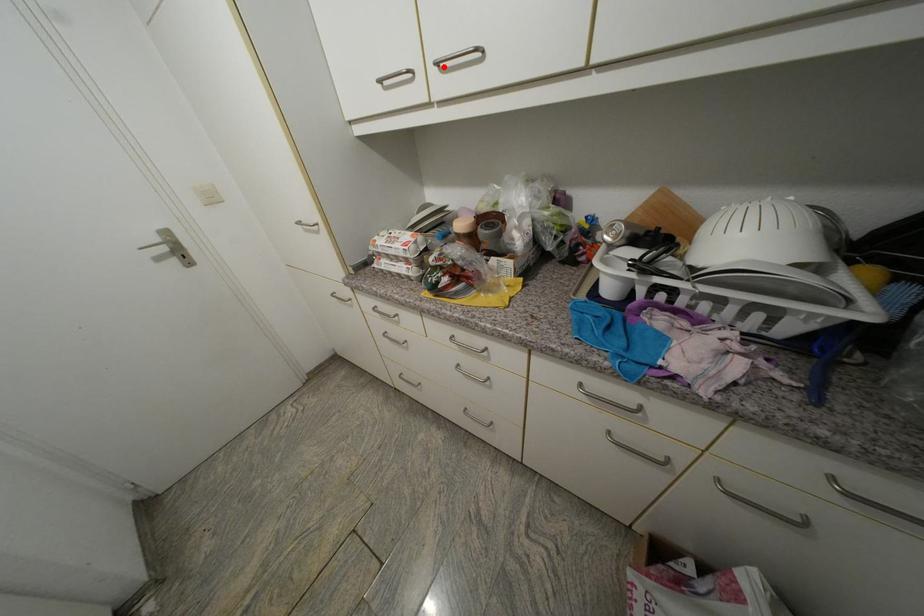
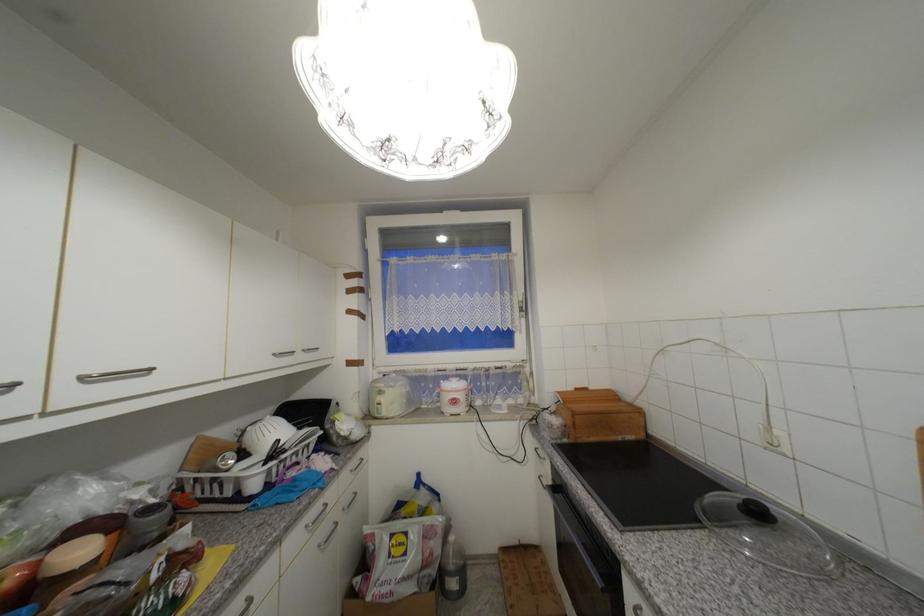
In the second image, find the point that corresponds to the highlighted location in the first image.

(89, 379)